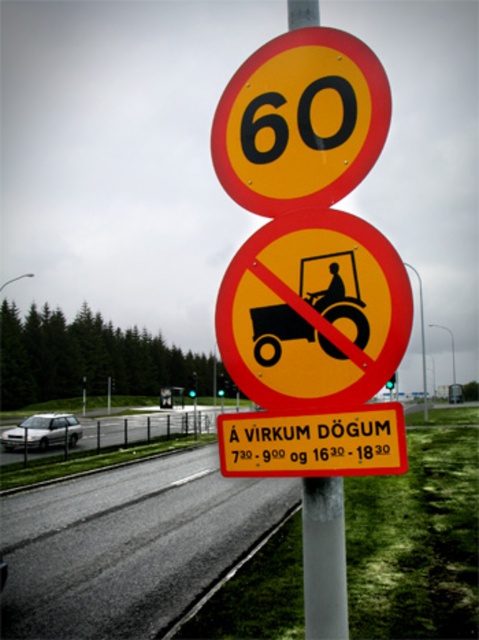
Question: Does yellow matte sign at upper center appear over metallic pole at center?

Choices:
 (A) no
 (B) yes

Answer: (B)

Question: Considering the real-world distances, which object is closest to the yellow matte sign at upper center?

Choices:
 (A) yellowmaterial/texturewarning sign at upper center
 (B) metallic pole at center

Answer: (A)

Question: Which is farther from the metallic pole at center?

Choices:
 (A) yellowmaterial/texturewarning sign at upper center
 (B) yellow matte sign at upper center

Answer: (B)

Question: Can you confirm if yellow matte sign at upper center is positioned to the right of metallic pole at center?

Choices:
 (A) no
 (B) yes

Answer: (A)

Question: From the image, what is the correct spatial relationship of yellow matte sign at upper center in relation to metallic pole at center?

Choices:
 (A) left
 (B) right

Answer: (A)

Question: Which object appears closest to the camera in this image?

Choices:
 (A) metallic pole at center
 (B) yellow matte sign at upper center

Answer: (A)